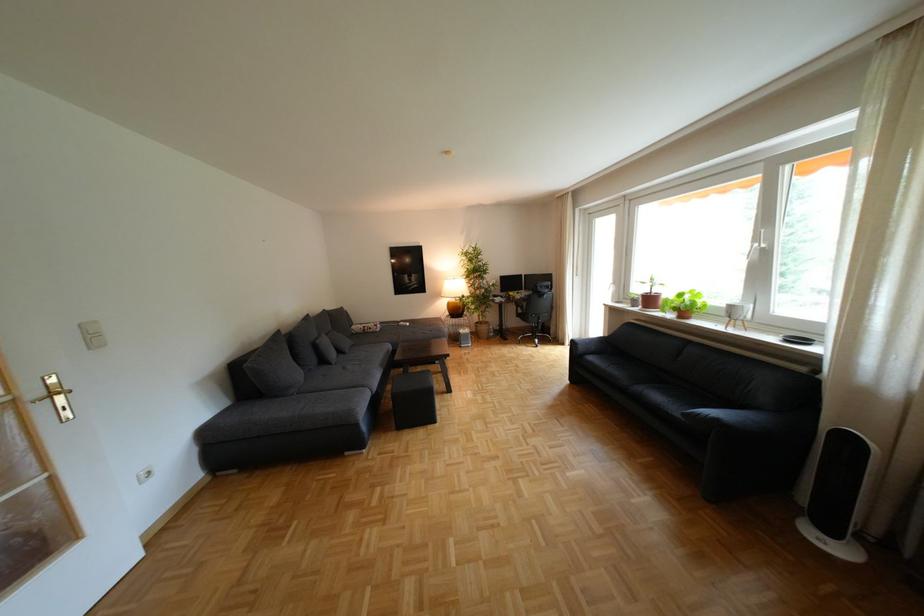
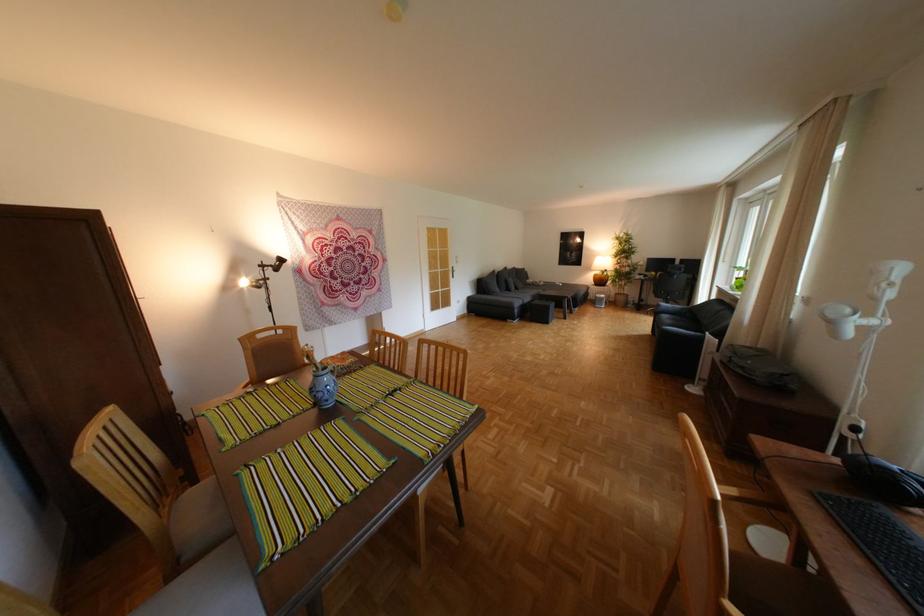
Locate, in the second image, the point that corresponds to point 476,270 in the first image.

(626, 252)